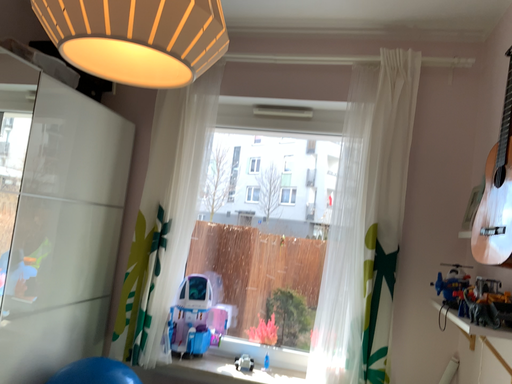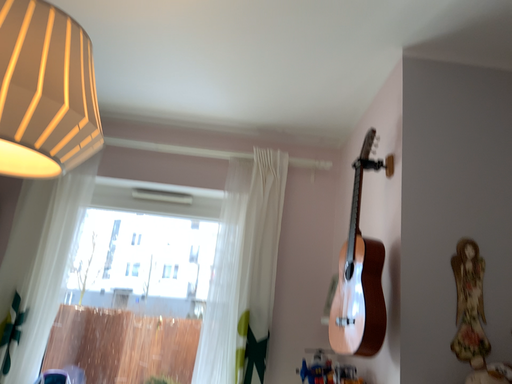
Question: How did the camera likely rotate when shooting the video?

Choices:
 (A) rotated left
 (B) rotated right

Answer: (B)